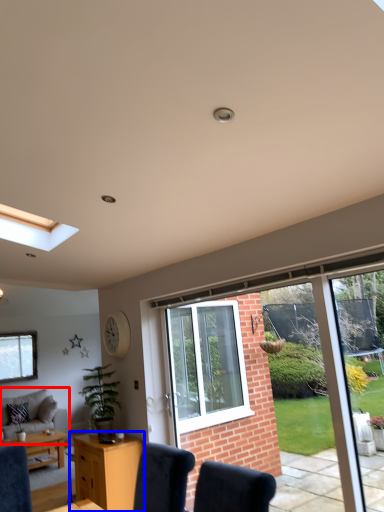
Question: Among these objects, which one is farthest to the camera, studio couch (highlighted by a red box) or desk (highlighted by a blue box)?

Choices:
 (A) studio couch
 (B) desk

Answer: (A)